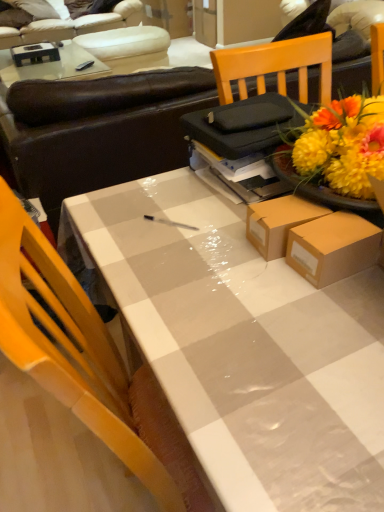
Question: From the image's perspective, is white leather couch at upper left, which is counted as the 1th studio couch, starting from the back, positioned above or below brown leather couch at upper center, the second studio couch viewed from the top?

Choices:
 (A) below
 (B) above

Answer: (B)

Question: Based on their positions, is white leather couch at upper left, the second studio couch positioned from the bottom, located to the left or right of brown leather couch at upper center, the second studio couch when ordered from back to front?

Choices:
 (A) right
 (B) left

Answer: (B)

Question: Considering the real-world distances, which object is closest to the white glossy table at center?

Choices:
 (A) brown leather couch at upper center, the second studio couch viewed from the top
 (B) white leather couch at upper left, which ranks as the first studio couch in top-to-bottom order
 (C) white leather armchair at upper left

Answer: (A)

Question: Which object is positioned closest to the brown leather couch at upper center, the second studio couch when ordered from back to front?

Choices:
 (A) white leather couch at upper left, which is counted as the 1th studio couch, starting from the back
 (B) white glossy table at center
 (C) white leather armchair at upper left

Answer: (B)